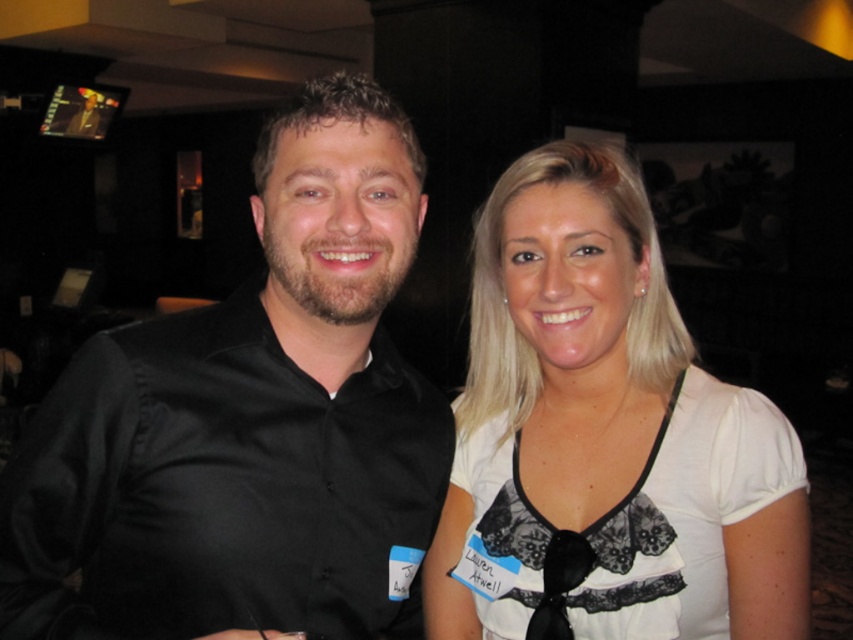
Based on the photo, you are a photographer setting up for a group photo. You notice the black satin shirt at left and the black satin tie at center in the frame. Which object should you adjust to ensure both are equally visible in the photo?

The black satin tie at center should be adjusted because the black satin shirt at left is taller, so lowering the shirt or raising the tie could balance their visibility.

You are a photographer trying to adjust the lighting for a group photo. You notice the black satin shirt at left and the white lace blouse at center. Which object should you focus on to ensure proper exposure, considering their positions?

The black satin shirt at left is in front of the white lace blouse at center, so focusing on the black satin shirt at left would ensure proper exposure since it is closer to the camera.

You are a photographer adjusting the camera focus. The camera has a depth of field that can cover a maximum distance of 7 inches. You need to ensure both the white lace blouse at center and the black satin tie at center are in focus. Is this possible?

The distance between the white lace blouse at center and the black satin tie at center is 8.04 inches, which exceeds the camera depth of field of 7 inches. Therefore, it is not possible to have both in focus simultaneously.